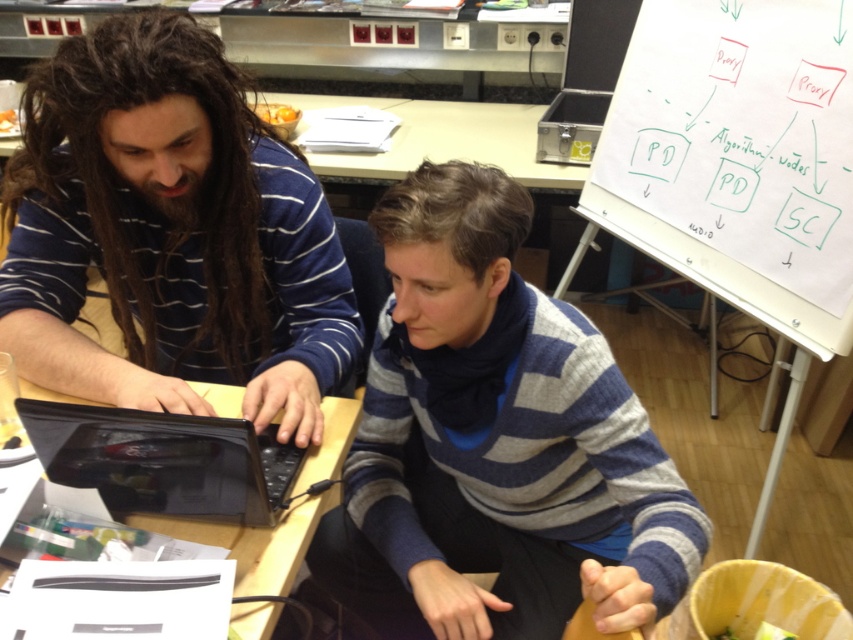
Is matte striped sweater at left shorter than black plastic laptop at center?

No, matte striped sweater at left is not shorter than black plastic laptop at center.

Which of these two, matte striped sweater at left or black plastic laptop at center, stands shorter?

black plastic laptop at center

Locate an element on the screen. This screenshot has height=640, width=853. matte striped sweater at left is located at coordinates (171, 234).

Is point (512, 358) closer to camera compared to point (231, 372)?

Yes, point (512, 358) is in front of point (231, 372).

Can you confirm if striped sweater at center is taller than matte striped sweater at left?

Yes.

The width and height of the screenshot is (853, 640). What do you see at coordinates (496, 442) in the screenshot?
I see `striped sweater at center` at bounding box center [496, 442].

You are a GUI agent. You are given a task and a screenshot of the screen. Output one action in this format:
    pyautogui.click(x=<x>, y=<y>)
    Task: Click on the striped sweater at center
    
    Given the screenshot: What is the action you would take?
    pyautogui.click(x=496, y=442)

From the picture: Can you confirm if glossy black laptop at center is positioned above black plastic laptop at center?

Yes, glossy black laptop at center is above black plastic laptop at center.

Which is below, glossy black laptop at center or black plastic laptop at center?

black plastic laptop at center is lower down.

Does point (207, 477) come in front of point (210, 385)?

Yes, it is in front of point (210, 385).

Locate an element on the screen. This screenshot has height=640, width=853. glossy black laptop at center is located at coordinates pyautogui.click(x=163, y=460).